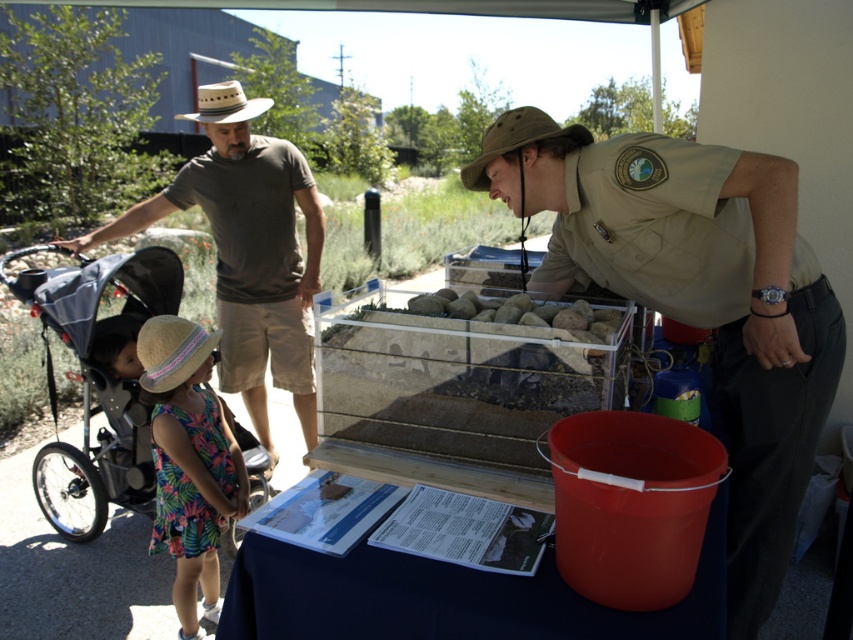
Looking at this image, you are standing at the event and notice a man wearing a brown cotton shirt at left and a green canvas hat at upper center. Which item is located lower in the scene?

The brown cotton shirt at left is positioned under the green canvas hat at upper center, so it is located lower in the scene.

You are at an outdoor event and see a khaki uniform at center and a brown cotton shirt at left. Which person is standing to the right of the other?

The khaki uniform at center is to the right of the brown cotton shirt at left.